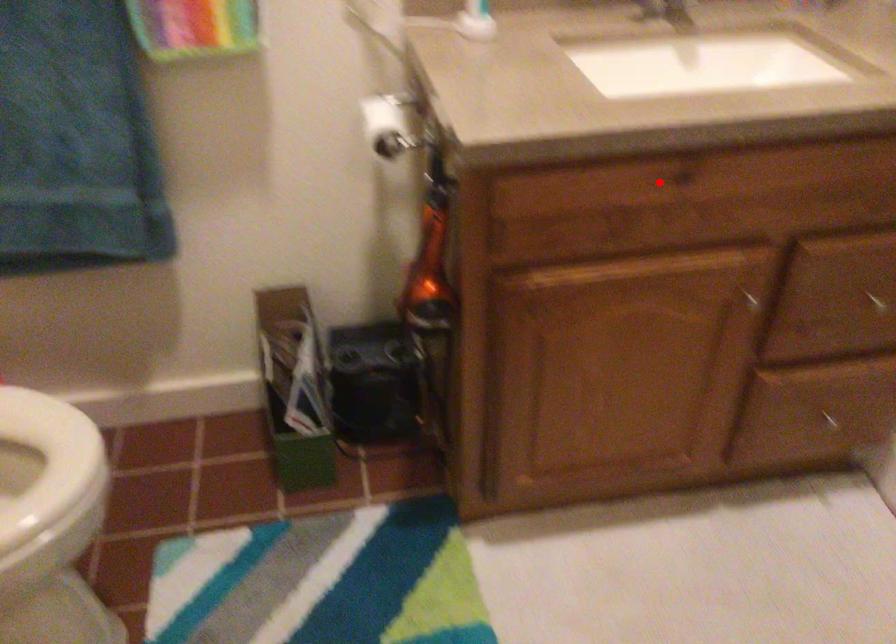
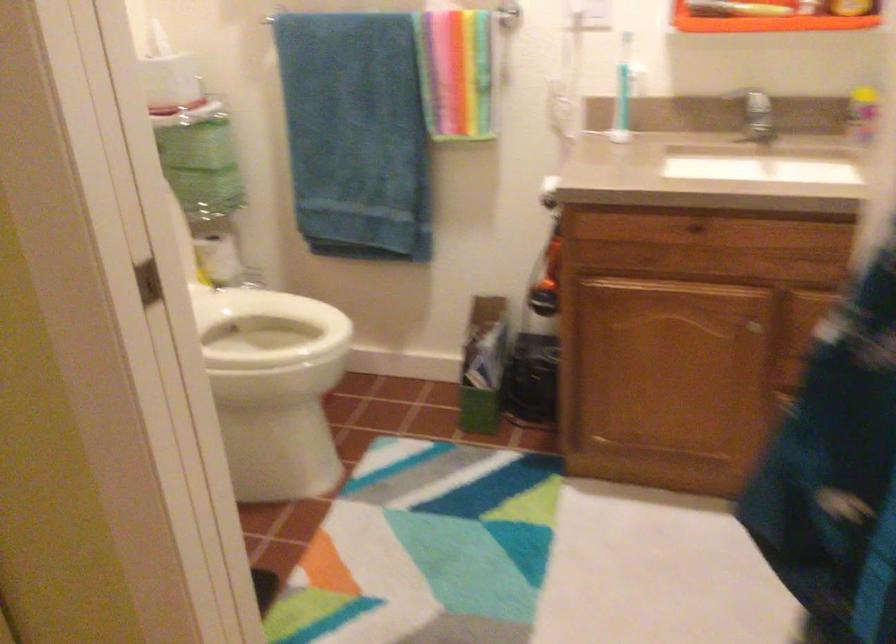
Locate, in the second image, the point that corresponds to the highlighted location in the first image.

(692, 229)